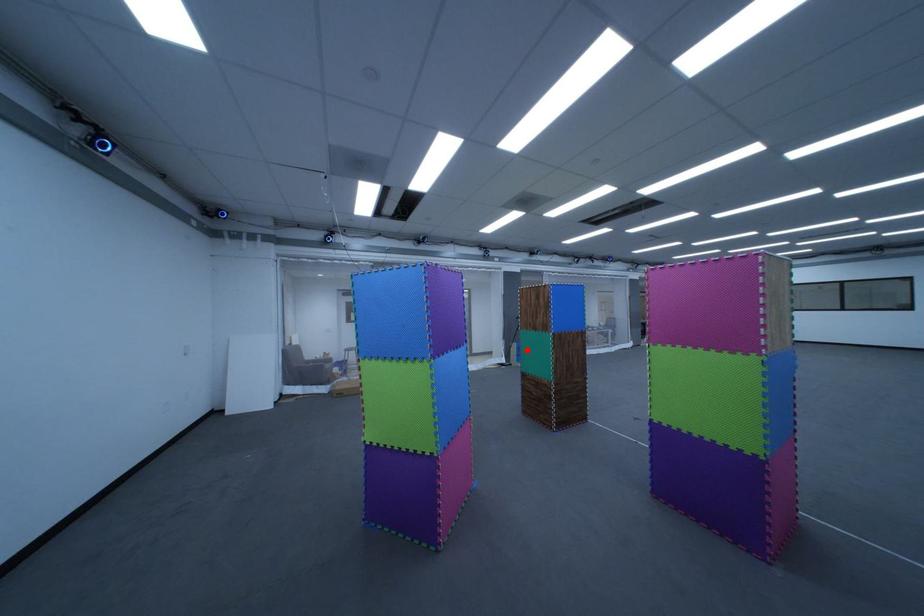
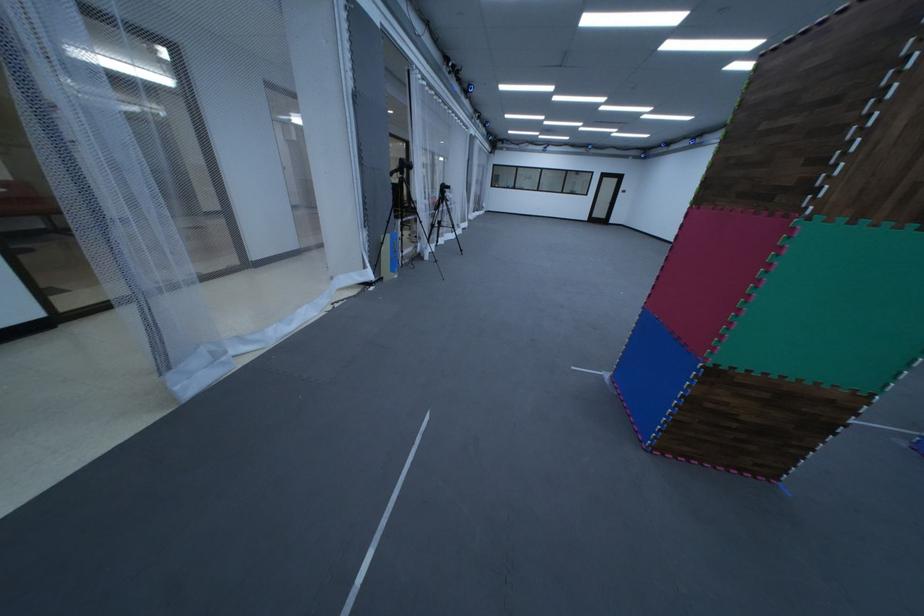
Question: I am providing you with two images of the same scene from different viewpoints. Given a red point in image1, look at the same physical point in image2. Is it:

Choices:
 (A) Closer to the viewpoint
 (B) Farther from the viewpoint

Answer: (A)